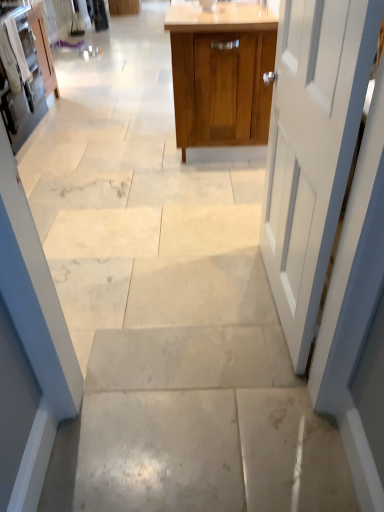
Question: Considering the relative sizes of matte white cabinet at left, which is counted as the second cabinetry, starting from the left, and white painted wood door at right in the image provided, is matte white cabinet at left, which is counted as the second cabinetry, starting from the left, taller than white painted wood door at right?

Choices:
 (A) no
 (B) yes

Answer: (A)

Question: Can you confirm if matte white cabinet at left, which is counted as the second cabinetry, starting from the left, is smaller than white painted wood door at right?

Choices:
 (A) no
 (B) yes

Answer: (A)

Question: From the image's perspective, does matte white cabinet at left, which is counted as the second cabinetry, starting from the left, appear higher than white painted wood door at right?

Choices:
 (A) no
 (B) yes

Answer: (B)

Question: Is matte white cabinet at left, which is counted as the second cabinetry, starting from the right, positioned in front of white painted wood door at right?

Choices:
 (A) yes
 (B) no

Answer: (B)

Question: Does matte white cabinet at left, which is counted as the second cabinetry, starting from the right, appear on the left side of white painted wood door at right?

Choices:
 (A) yes
 (B) no

Answer: (A)

Question: In the image, is matte white cabinet at left, which is counted as the second cabinetry, starting from the right, on the left side or the right side of wooden cabinet at center, the third cabinetry positioned from the left?

Choices:
 (A) left
 (B) right

Answer: (A)

Question: From a real-world perspective, is matte white cabinet at left, which is counted as the second cabinetry, starting from the left, physically located above or below wooden cabinet at center, the third cabinetry positioned from the left?

Choices:
 (A) below
 (B) above

Answer: (A)

Question: Looking at the image, does matte white cabinet at left, which is counted as the second cabinetry, starting from the left, seem bigger or smaller compared to wooden cabinet at center, which ranks as the 1th cabinetry in right-to-left order?

Choices:
 (A) small
 (B) big

Answer: (A)

Question: From the image's perspective, is matte white cabinet at left, which is counted as the second cabinetry, starting from the right, positioned above or below wooden cabinet at center, which ranks as the 1th cabinetry in right-to-left order?

Choices:
 (A) below
 (B) above

Answer: (A)

Question: In terms of width, does white painted wood door at right look wider or thinner when compared to wooden cabinet at center, which ranks as the 1th cabinetry in right-to-left order?

Choices:
 (A) thin
 (B) wide

Answer: (A)

Question: Is white painted wood door at right inside the boundaries of wooden cabinet at center, which ranks as the 1th cabinetry in right-to-left order, or outside?

Choices:
 (A) outside
 (B) inside

Answer: (A)

Question: Based on their positions, is white painted wood door at right located to the left or right of wooden cabinet at center, which ranks as the 1th cabinetry in right-to-left order?

Choices:
 (A) right
 (B) left

Answer: (B)

Question: From a real-world perspective, is white painted wood door at right positioned above or below wooden cabinet at center, which ranks as the 1th cabinetry in right-to-left order?

Choices:
 (A) above
 (B) below

Answer: (A)

Question: Considering the positions of white painted wood door at right and matte white cabinet at upper left, which is the third cabinetry in right-to-left order, in the image, is white painted wood door at right taller or shorter than matte white cabinet at upper left, which is the third cabinetry in right-to-left order,?

Choices:
 (A) short
 (B) tall

Answer: (B)

Question: In terms of width, does white painted wood door at right look wider or thinner when compared to matte white cabinet at upper left, which is the third cabinetry in right-to-left order?

Choices:
 (A) wide
 (B) thin

Answer: (B)